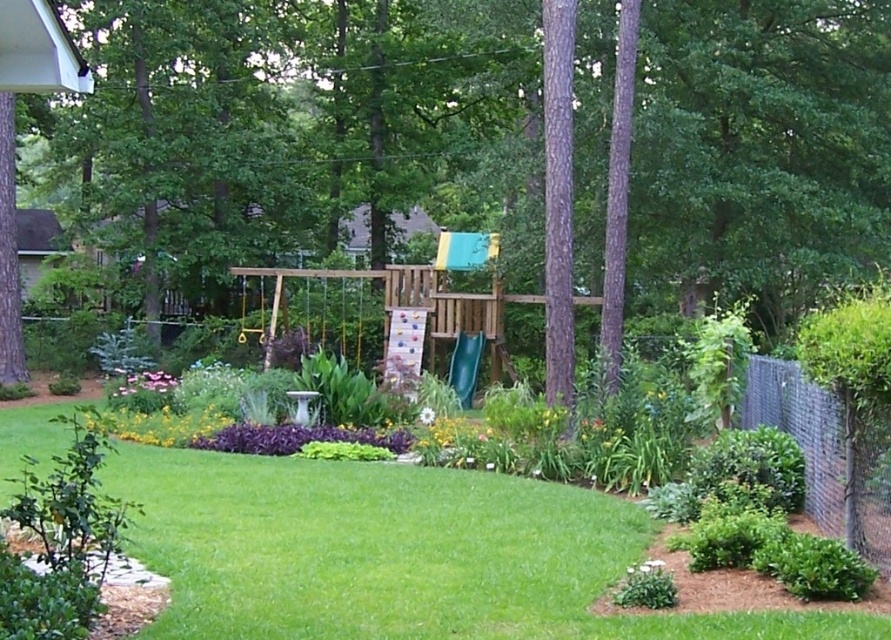
How distant is gray wire mesh fence at right from pink matte flower at lower left?

They are 15.51 meters apart.

The height and width of the screenshot is (640, 891). Find the location of `gray wire mesh fence at right`. gray wire mesh fence at right is located at coordinates (826, 454).

Can you confirm if green plastic slide at center is taller than pink matte flower at lower left?

Yes, green plastic slide at center is taller than pink matte flower at lower left.

Which is more to the right, green plastic slide at center or pink matte flower at lower left?

green plastic slide at center

Where is `green plastic slide at center`? This screenshot has height=640, width=891. green plastic slide at center is located at coordinates tap(464, 365).

Find the location of `green plastic slide at center`. green plastic slide at center is located at coordinates (464, 365).

Does brown rough bark tree at center have a lesser height compared to pink matte flower at lower left?

No, brown rough bark tree at center is not shorter than pink matte flower at lower left.

Between brown rough bark tree at center and pink matte flower at lower left, which one is positioned higher?

brown rough bark tree at center

This screenshot has width=891, height=640. In order to click on brown rough bark tree at center in this screenshot , I will do `click(618, 193)`.